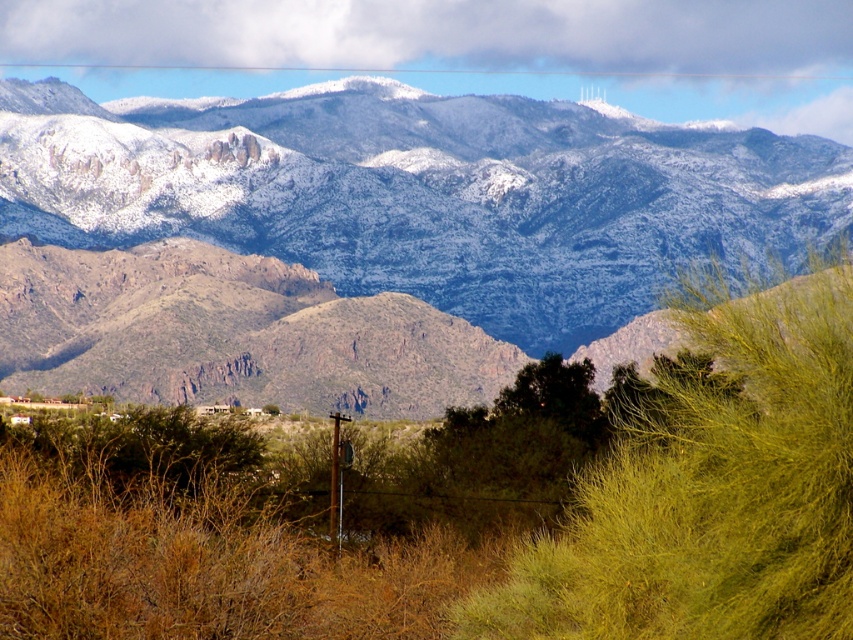
Can you confirm if snow-covered mountains at upper center is smaller than green leafy bush at center?

Incorrect, snow-covered mountains at upper center is not smaller in size than green leafy bush at center.

Who is positioned more to the right, snow-covered mountains at upper center or green leafy bush at center?

green leafy bush at center is more to the right.

Who is more distant from viewer, [0,362] or [572,552]?

The point [0,362] is behind.

Identify the location of snow-covered mountains at upper center. (369, 237).